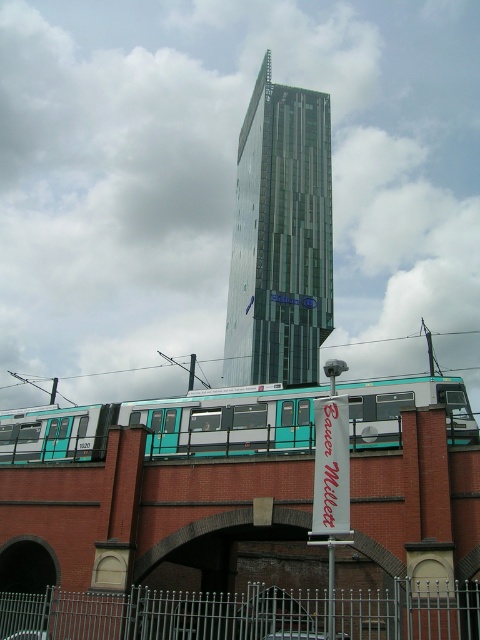
Does glassy metallic skyscraper at center have a greater width compared to teal matte train at center?

Indeed, glassy metallic skyscraper at center has a greater width compared to teal matte train at center.

Does glassy metallic skyscraper at center have a lesser width compared to teal matte train at center?

In fact, glassy metallic skyscraper at center might be wider than teal matte train at center.

This screenshot has height=640, width=480. I want to click on glassy metallic skyscraper at center, so click(280, 237).